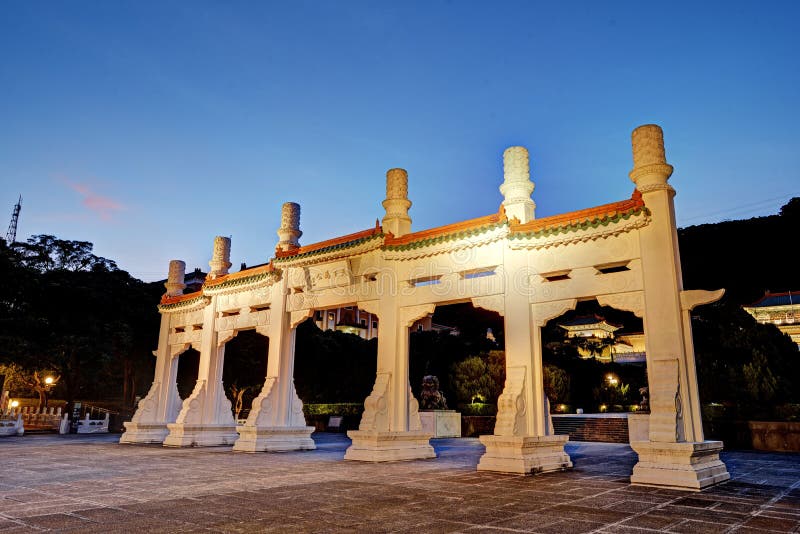
You are a GUI agent. You are given a task and a screenshot of the screen. Output one action in this format:
    pyautogui.click(x=<x>, y=<y>)
    Task: Click on the sculpture base
    Image resolution: width=800 pixels, height=534 pixels.
    Given the screenshot: What is the action you would take?
    pyautogui.click(x=440, y=427)